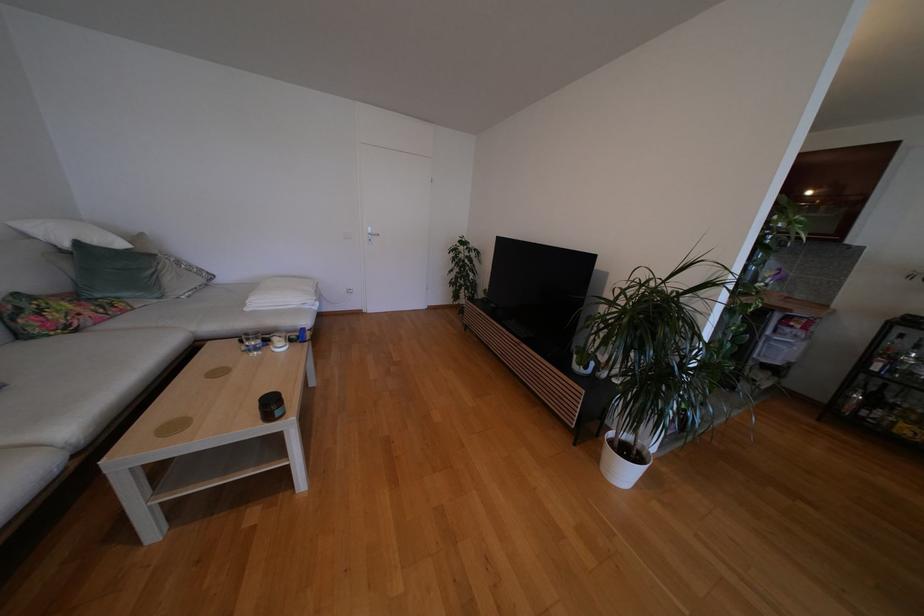
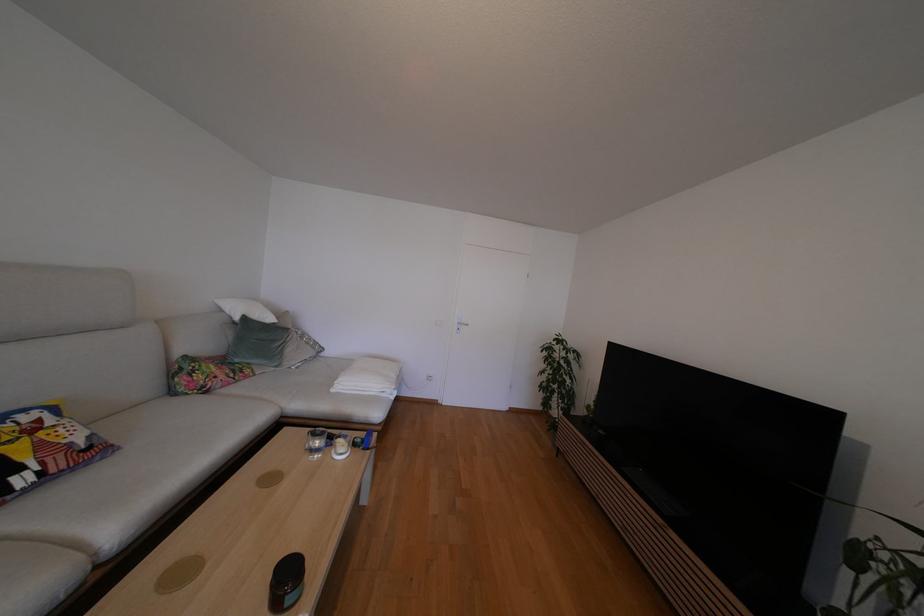
The point at [102,298] is marked in the first image. Where is the corresponding point in the second image?

(241, 363)